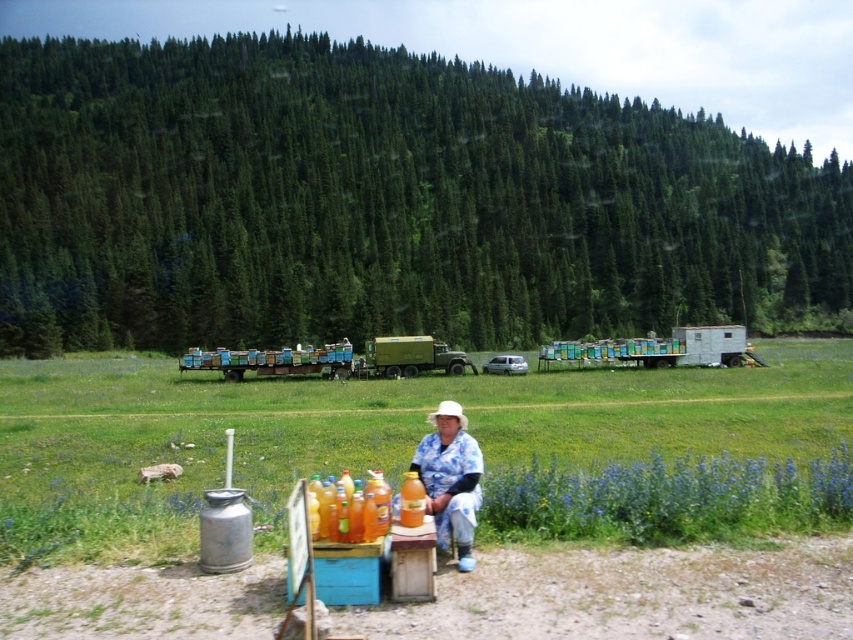
You are a visitor at a countryside market and see both the blue floral shirt at center and the wooden beehives at center. Which item is positioned to the right when looking at them from your perspective?

The blue floral shirt at center is to the right of the wooden beehives at center.

You are standing in the rural outdoor scene looking at the woman and the objects. Which of the two points, point 1 at coordinates (544, 388) or point 2 at (421, 358), is closer to you?

Point 1 at coordinates (544, 388) is closer to you than point 2 at (421, 358).